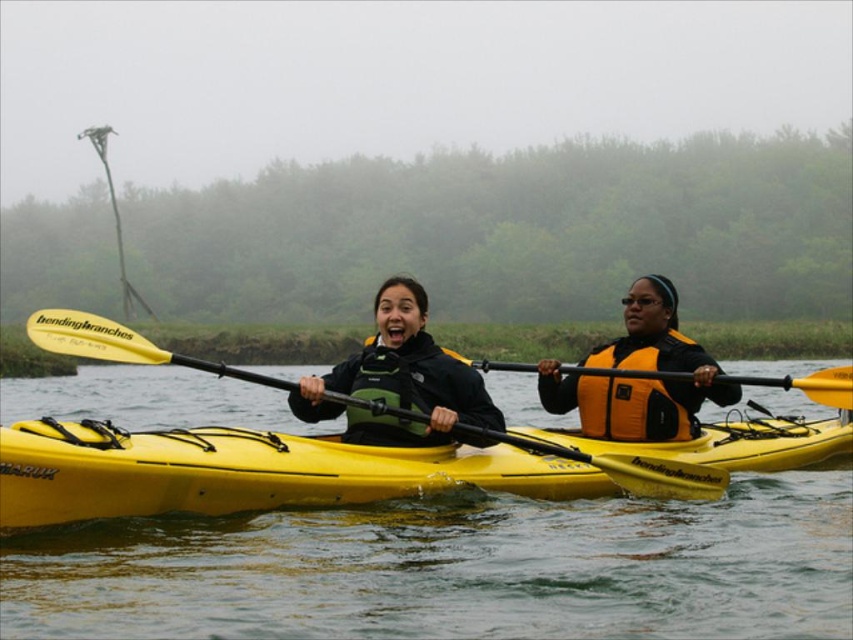
Question: Which point is closer to the camera?

Choices:
 (A) (473, 554)
 (B) (642, 490)
 (C) (380, 403)

Answer: (C)

Question: Does green fabric life jacket at center have a smaller size compared to yellow matte paddle at center?

Choices:
 (A) no
 (B) yes

Answer: (B)

Question: Which point is farther from the camera taking this photo?

Choices:
 (A) (440, 364)
 (B) (0, 550)
 (C) (688, 496)

Answer: (C)

Question: Is orange/yellow fabric life jacket at right positioned before yellow matte paddle at center?

Choices:
 (A) no
 (B) yes

Answer: (A)

Question: Among these points, which one is nearest to the camera?

Choices:
 (A) (619, 410)
 (B) (413, 390)
 (C) (668, 310)

Answer: (B)

Question: Does yellow plastic paddle at center come behind green fabric life jacket at center?

Choices:
 (A) yes
 (B) no

Answer: (B)